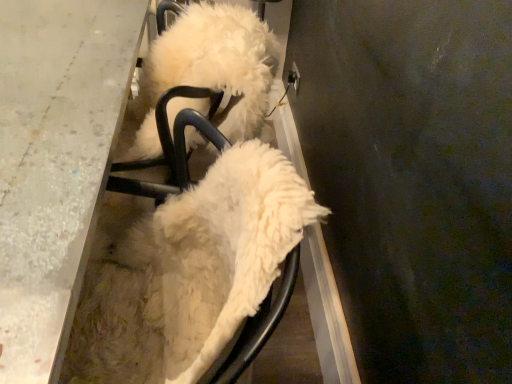
Question: Is white fluffy dog at center in front of or behind white glossy table at left in the image?

Choices:
 (A) front
 (B) behind

Answer: (A)

Question: From a real-world perspective, relative to white glossy table at left, is white fluffy dog at center vertically above or below?

Choices:
 (A) above
 (B) below

Answer: (A)

Question: Does point (132, 236) appear closer or farther from the camera than point (20, 162)?

Choices:
 (A) farther
 (B) closer

Answer: (A)

Question: Looking at their shapes, would you say white glossy table at left is wider or thinner than white fluffy dog at center?

Choices:
 (A) thin
 (B) wide

Answer: (A)

Question: From the image's perspective, is white glossy table at left above or below white fluffy dog at center?

Choices:
 (A) below
 (B) above

Answer: (B)

Question: From a real-world perspective, is white glossy table at left positioned above or below white fluffy dog at center?

Choices:
 (A) below
 (B) above

Answer: (A)

Question: Is white glossy table at left taller or shorter than white fluffy dog at center?

Choices:
 (A) short
 (B) tall

Answer: (A)